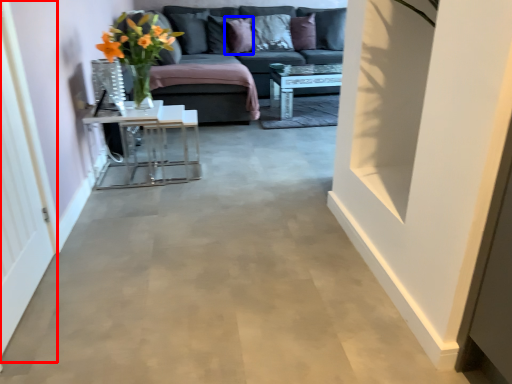
Question: Which object appears closest to the camera in this image, glass door (highlighted by a red box) or pillow (highlighted by a blue box)?

Choices:
 (A) glass door
 (B) pillow

Answer: (A)